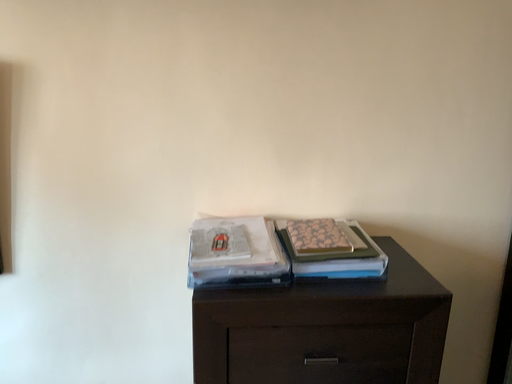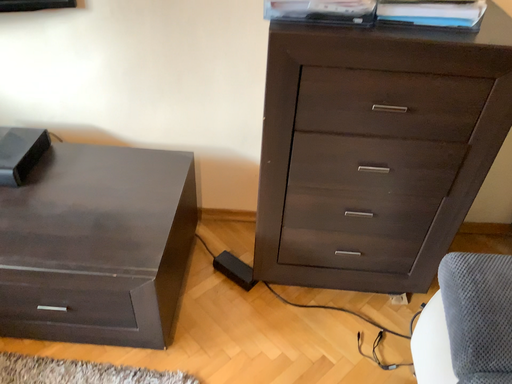
Question: How did the camera likely rotate when shooting the video?

Choices:
 (A) rotated upward
 (B) rotated downward

Answer: (B)